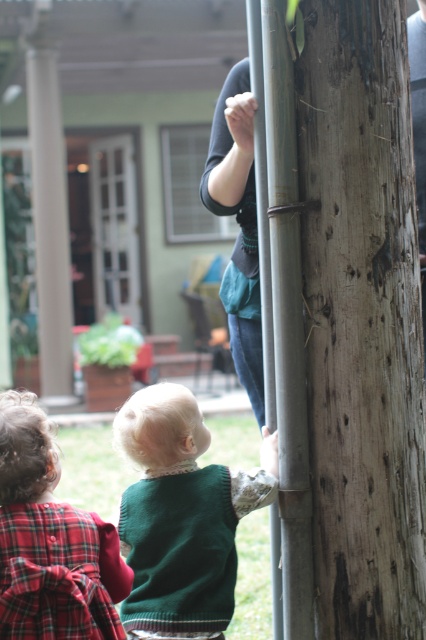
Question: Which of these objects is positioned farthest from the green knitted sweater at center?

Choices:
 (A) silver metallic pole at center
 (B) wooden textured tree trunk at right
 (C) plaid fabric dress at lower left

Answer: (B)

Question: Observing the image, what is the correct spatial positioning of wooden textured tree trunk at right in reference to plaid fabric dress at lower left?

Choices:
 (A) right
 (B) left

Answer: (A)

Question: Does wooden textured tree trunk at right appear under green knitted sweater at center?

Choices:
 (A) no
 (B) yes

Answer: (A)

Question: Does wooden textured tree trunk at right have a lesser width compared to plaid fabric dress at lower left?

Choices:
 (A) yes
 (B) no

Answer: (B)

Question: Which point is closer to the camera?

Choices:
 (A) (304, 483)
 (B) (143, 573)
 (C) (391, 150)
 (D) (17, 483)

Answer: (C)

Question: Which point is farther to the camera?

Choices:
 (A) wooden textured tree trunk at right
 (B) green knitted sweater at center
 (C) silver metallic pole at center
 (D) plaid fabric dress at lower left

Answer: (B)